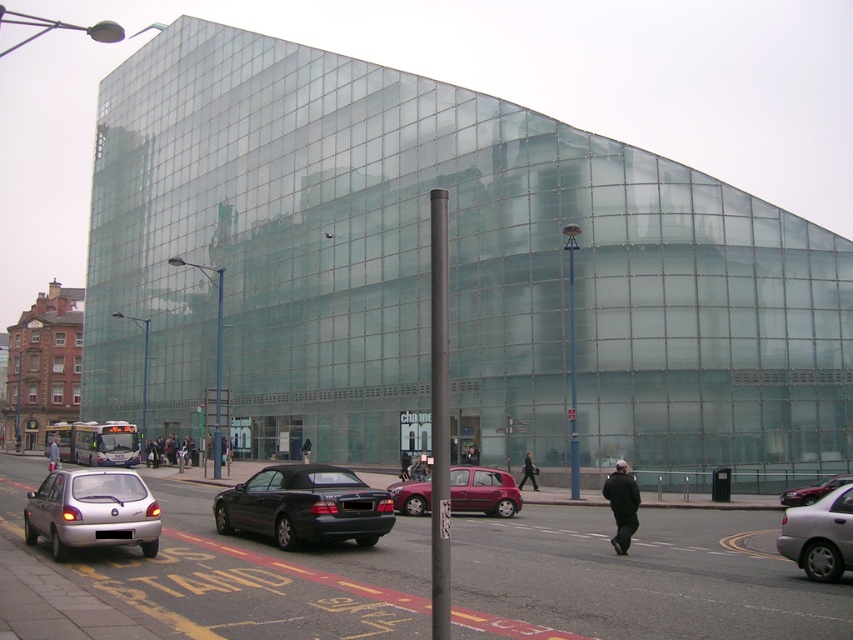
You are standing in front of the modern glass building and see the point at coordinates (91, 512). What object is located at that point?

The point at coordinates (91, 512) corresponds to the silver metallic hatchback at lower left.

You are standing in front of the modern glass building and want to reach a specific point marked at coordinates point [149,518]. Considering the busy street with vehicles like the silver car, black sedan, red hatchback, and white bus, is the path to this point obstructed by any of these vehicles?

The point [149,518] is 40.08 feet from the viewer. Since the vehicles mentioned are on the street, and the distance is significant, it is likely that the path to the point is not obstructed by the vehicles as they are part of the traffic flow and the point might be on the sidewalk or further away.

You are a delivery driver who needs to park your 5.5 meter long truck between the silver metallic hatchback at lower left and the metallic maroon hatchback at center. Is there enough space between them to park your truck?

The distance between the silver metallic hatchback at lower left and the metallic maroon hatchback at center is 13.39 meters. Since your truck is 5.5 meters long, there is sufficient space to park between them as the available space is more than double the truck length.